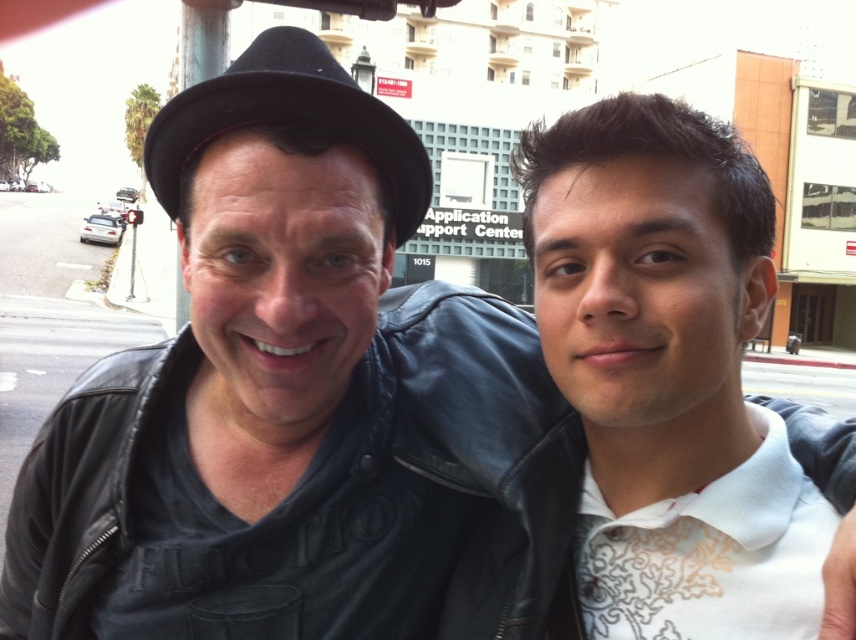
Question: Does white textured shirt at center have a greater width compared to black felt plug hat at upper left?

Choices:
 (A) no
 (B) yes

Answer: (A)

Question: Where is white textured shirt at center located in relation to black felt plug hat at upper left in the image?

Choices:
 (A) right
 (B) left

Answer: (A)

Question: Which of the following is the farthest from the observer?

Choices:
 (A) (545, 349)
 (B) (180, 148)

Answer: (A)

Question: Is white textured shirt at center positioned in front of black felt plug hat at upper left?

Choices:
 (A) yes
 (B) no

Answer: (A)

Question: Which point is farther to the camera?

Choices:
 (A) white textured shirt at center
 (B) black felt plug hat at upper left

Answer: (B)

Question: Which of the following is the farthest from the observer?

Choices:
 (A) white textured shirt at center
 (B) black felt plug hat at upper left

Answer: (B)